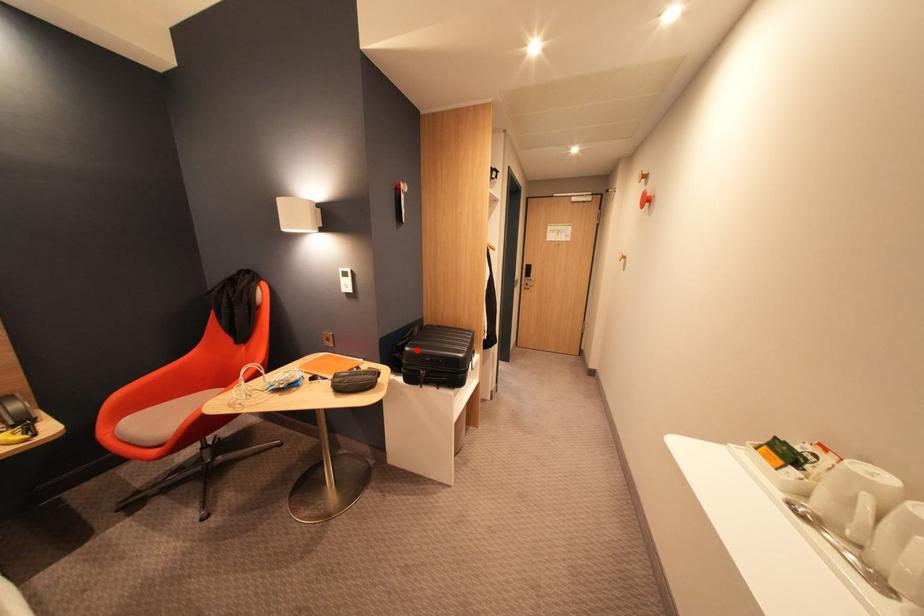
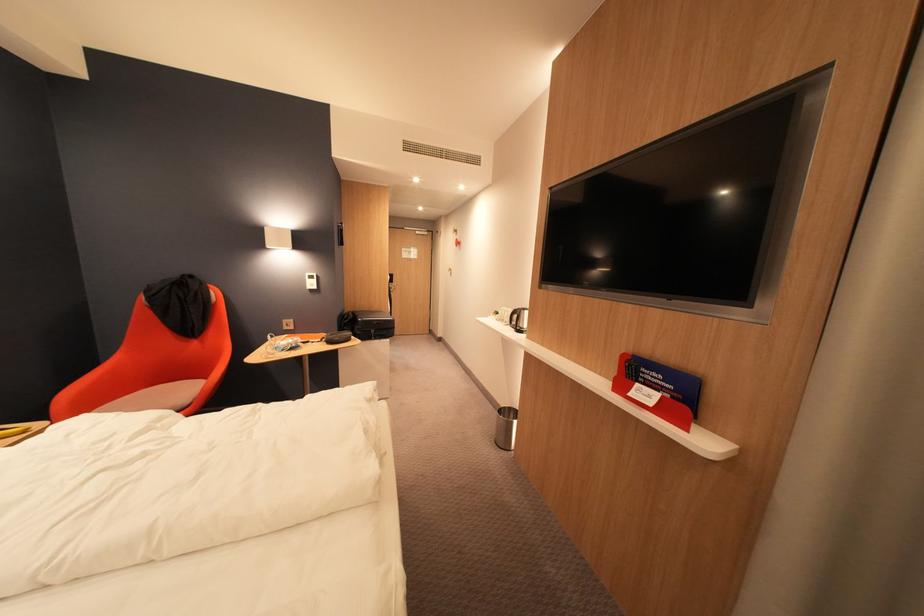
The point at the highlighted location is marked in the first image. Where is the corresponding point in the second image?

(370, 321)